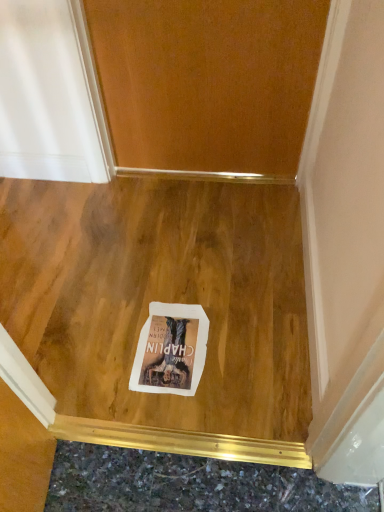
I want to click on free region under white paper postcard at center (from a real-world perspective), so click(x=163, y=350).